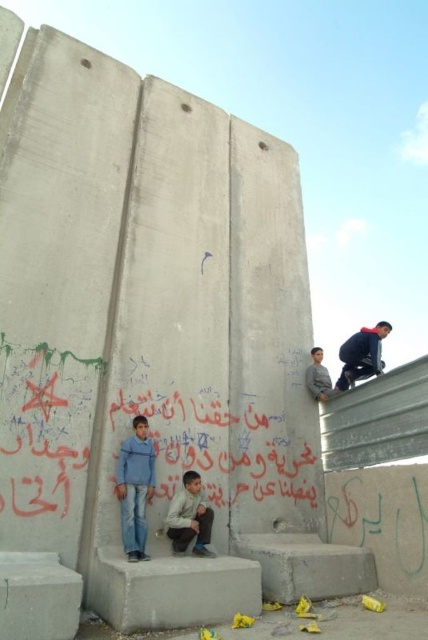
Between light brown fabric pants at lower center and gray fabric jacket at upper right, which one has less height?

gray fabric jacket at upper right is shorter.

How far apart are light brown fabric pants at lower center and gray fabric jacket at upper right?

light brown fabric pants at lower center is 2.79 meters away from gray fabric jacket at upper right.

Is point (190, 486) behind point (314, 360)?

No, it is not.

Where is `light brown fabric pants at lower center`? light brown fabric pants at lower center is located at coordinates (190, 516).

In the scene shown: Does light brown fabric pants at lower center appear under dark blue fabric jacket at upper right?

Yes.

Can you confirm if light brown fabric pants at lower center is positioned above dark blue fabric jacket at upper right?

No.

You are a GUI agent. You are given a task and a screenshot of the screen. Output one action in this format:
    pyautogui.click(x=<x>, y=<y>)
    Task: Click on the light brown fabric pants at lower center
    
    Given the screenshot: What is the action you would take?
    point(190,516)

Is gray concrete block at lower left positioned in front of dark blue fabric jacket at upper right?

Yes, it is.

Which is behind, point (29, 577) or point (354, 362)?

The point (354, 362) is behind.

Find the location of a particular element. This screenshot has height=640, width=428. gray concrete block at lower left is located at coordinates (38, 596).